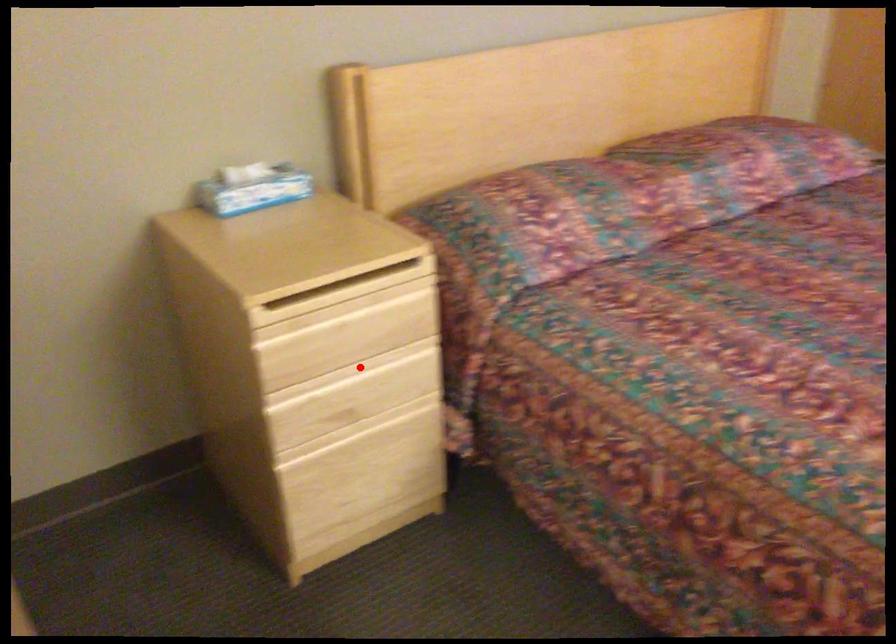
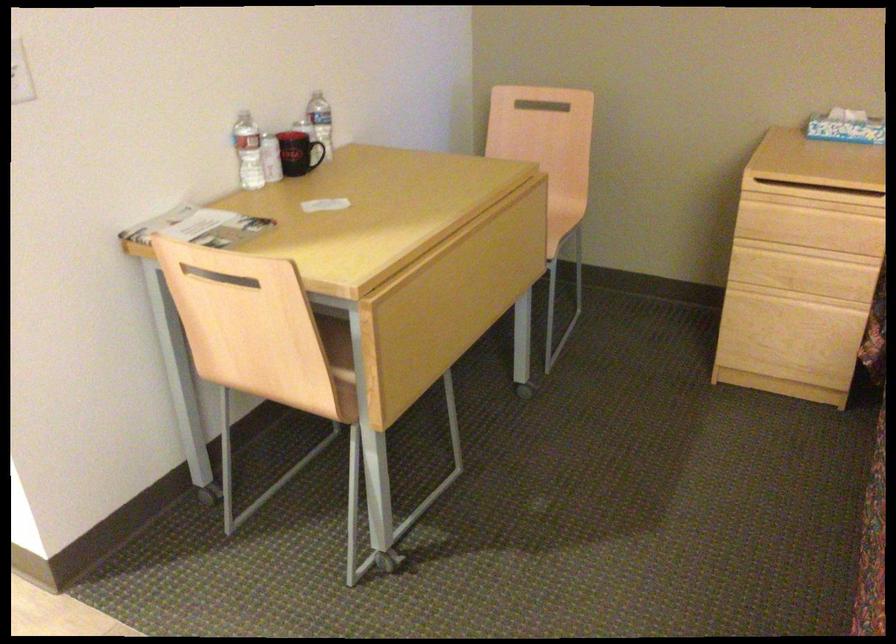
Find the pixel in the second image that matches the highlighted location in the first image.

(810, 251)